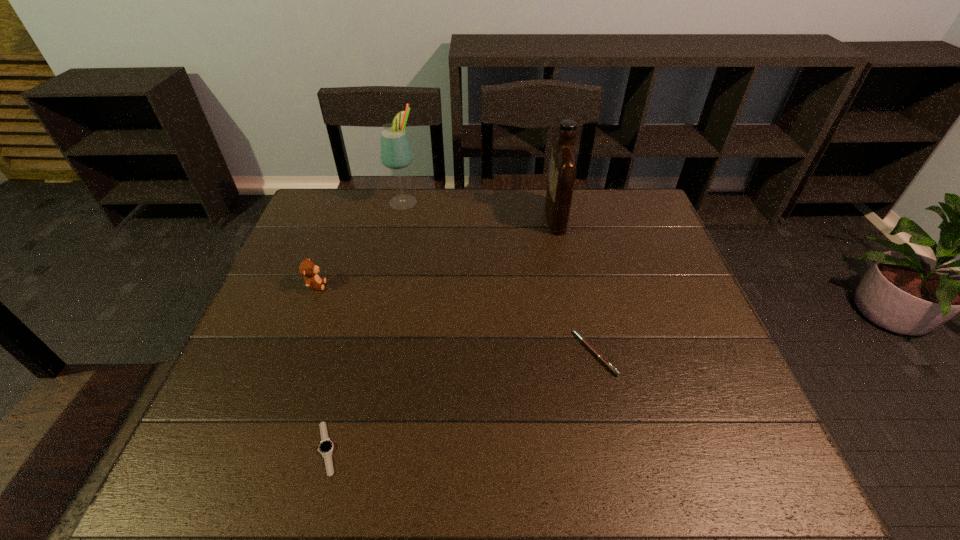
I want to click on free space that is in between the liquor and the third nearest object, so click(x=436, y=251).

Where is `free space between the alcohol and the shortest object`? This screenshot has height=540, width=960. free space between the alcohol and the shortest object is located at coordinates (366, 325).

Locate an element on the screen. This screenshot has width=960, height=540. empty space between the alcohol and the third tallest object is located at coordinates pos(360,244).

Where is `free space between the shortest object and the liquor`? The height and width of the screenshot is (540, 960). free space between the shortest object and the liquor is located at coordinates (441, 333).

Where is `vacant area that lies between the liquor and the nearest object`? vacant area that lies between the liquor and the nearest object is located at coordinates (441, 333).

Identify the location of empty space between the fourth tallest object and the alcohol. (499, 277).

You are a GUI agent. You are given a task and a screenshot of the screen. Output one action in this format:
    pyautogui.click(x=<x>, y=<y>)
    Task: Click on the object that is the closest one to the leftmost object
    The width and height of the screenshot is (960, 540).
    Given the screenshot: What is the action you would take?
    pyautogui.click(x=395, y=151)

Select which object appears as the closest to the second nearest object. Please provide its 2D coordinates. Your answer should be formatted as a tuple, i.e. [(x, y)], where the tuple contains the x and y coordinates of a point satisfying the conditions above.

[(563, 166)]

The height and width of the screenshot is (540, 960). What are the coordinates of `vacant position in the image that satisfies the following two spatial constraints: 1. on the back side of the alcohol; 2. on the right side of the shortest object` in the screenshot? It's located at (390, 201).